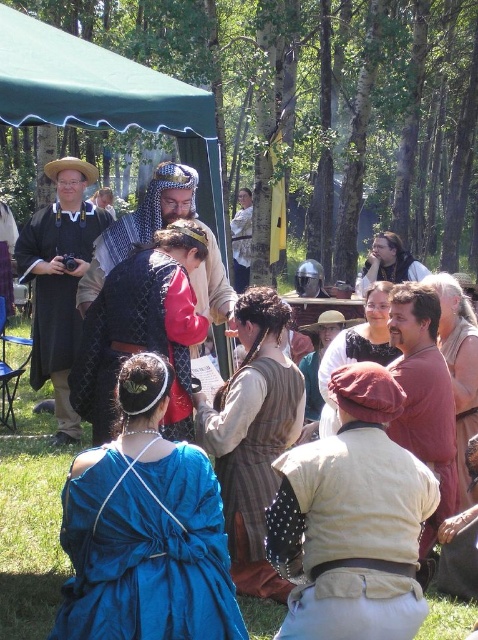
Question: Is brown textured vest at center to the left of matte black robe at left from the viewer's perspective?

Choices:
 (A) yes
 (B) no

Answer: (B)

Question: Which object is positioned farthest from the light brown leather jacket at center?

Choices:
 (A) blue satin dress at lower left
 (B) brown textured vest at center
 (C) matte black robe at left
 (D) brown leather hat at center

Answer: (A)

Question: Does beige leather armor at center lie behind quilted fabric vest at center?

Choices:
 (A) no
 (B) yes

Answer: (A)

Question: Which object appears farthest from the camera in this image?

Choices:
 (A) matte black tunic at center
 (B) matte brown dress at center
 (C) brown leather belt at lower right
 (D) light brown leather jacket at center

Answer: (D)

Question: Which point is farther from the camera taking this photo?

Choices:
 (A) (65, 397)
 (B) (259, 472)
 (C) (359, 289)
 (D) (346, 336)

Answer: (C)

Question: Can you confirm if light brown leather jacket at center is bigger than matte brown dress at center?

Choices:
 (A) yes
 (B) no

Answer: (A)